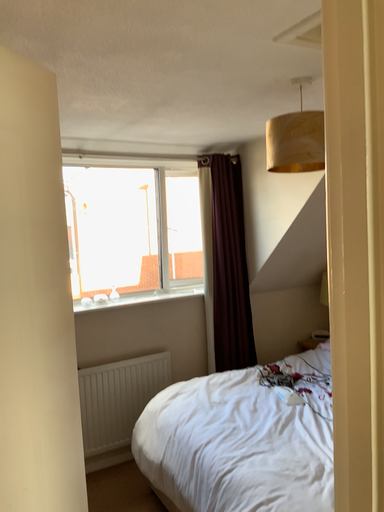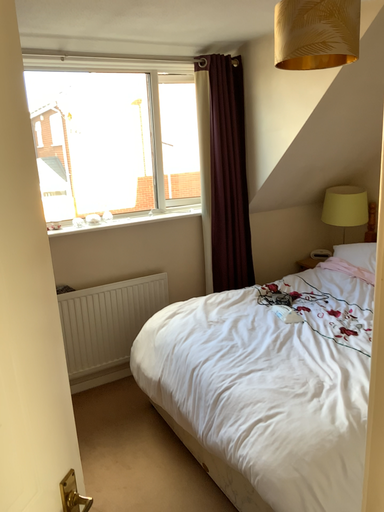
Question: Which way did the camera rotate in the video?

Choices:
 (A) rotated upward
 (B) rotated downward

Answer: (B)